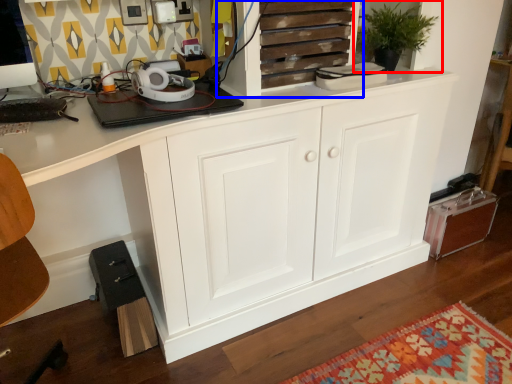
Question: Which object is closer to the camera taking this photo, houseplant (highlighted by a red box) or cupboard (highlighted by a blue box)?

Choices:
 (A) houseplant
 (B) cupboard

Answer: (B)